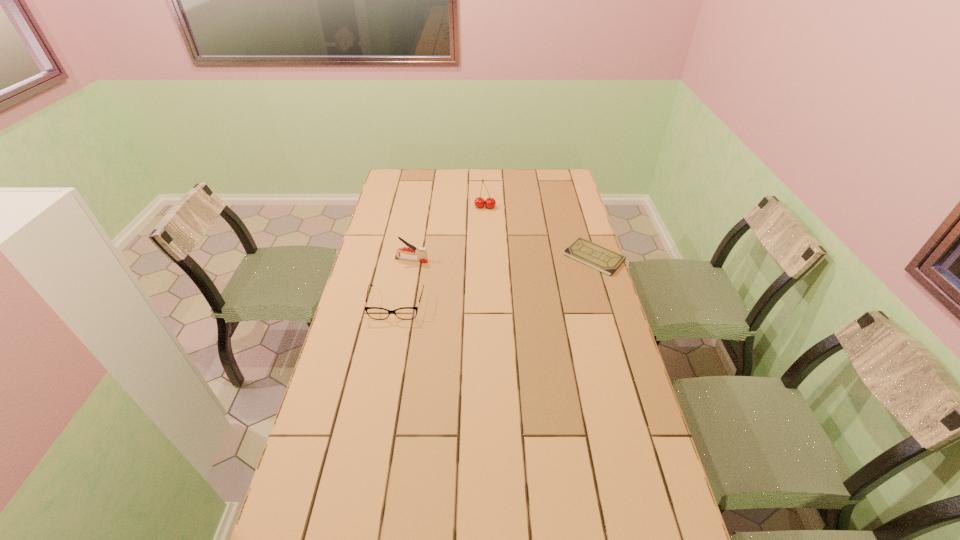
The width and height of the screenshot is (960, 540). In order to click on unoccupied position between the checkbook and the cherry in this screenshot , I will do `click(540, 232)`.

Identify the location of vacant space in between the stapler and the rightmost object. This screenshot has height=540, width=960. (503, 259).

Locate an element on the screen. This screenshot has height=540, width=960. vacant area that lies between the third tallest object and the shortest object is located at coordinates (495, 281).

Where is `the closest object to the rightmost object`? The image size is (960, 540). the closest object to the rightmost object is located at coordinates (479, 202).

The height and width of the screenshot is (540, 960). I want to click on object that ranks as the third closest to the stapler, so click(591, 254).

The image size is (960, 540). Identify the location of free spot that satisfies the following two spatial constraints: 1. on the front side of the checkbook; 2. on the right side of the cherry. (486, 257).